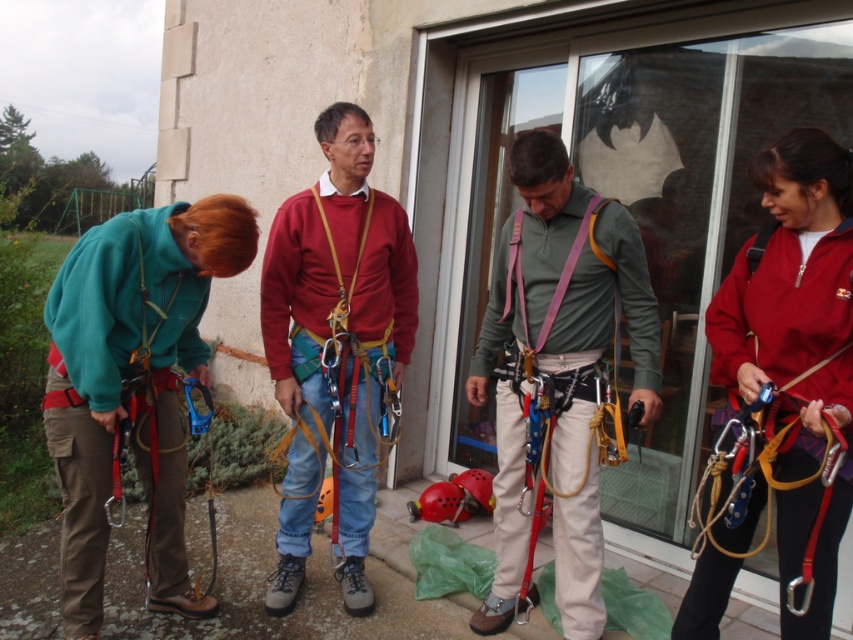
Question: Where is red fleece jacket at right located in relation to purple fabric strap at center in the image?

Choices:
 (A) above
 (B) below

Answer: (B)

Question: Does teal fleece jacket at left appear under red fleece jacket at right?

Choices:
 (A) yes
 (B) no

Answer: (A)

Question: Which point is closer to the camera?

Choices:
 (A) (151, 440)
 (B) (561, 296)

Answer: (B)

Question: Which object is positioned farthest from the matte green shirt at center?

Choices:
 (A) red fleece jacket at right
 (B) teal fleece jacket at left

Answer: (B)

Question: Can you confirm if matte green shirt at center is positioned below matte red sweater at center?

Choices:
 (A) no
 (B) yes

Answer: (B)

Question: Among these points, which one is farthest from the camera?

Choices:
 (A) (576, 333)
 (B) (527, 317)
 (C) (109, 509)
 (D) (805, 176)

Answer: (B)